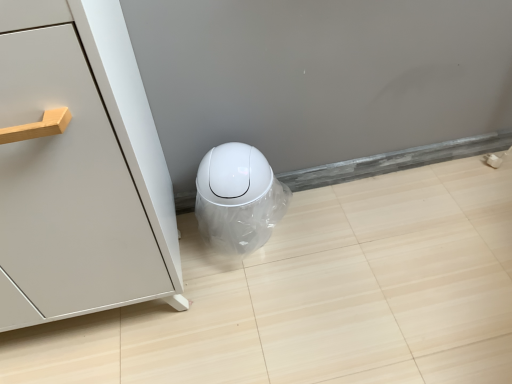
Question: From the image's perspective, is matte white cabinet at left above or below white glossy trash can at lower center?

Choices:
 (A) below
 (B) above

Answer: (B)

Question: Is point (108, 183) positioned closer to the camera than point (251, 165)?

Choices:
 (A) farther
 (B) closer

Answer: (B)

Question: In terms of width, does matte white cabinet at left look wider or thinner when compared to white glossy trash can at lower center?

Choices:
 (A) wide
 (B) thin

Answer: (A)

Question: Looking at their shapes, would you say white glossy trash can at lower center is wider or thinner than matte white cabinet at left?

Choices:
 (A) wide
 (B) thin

Answer: (B)

Question: Would you say white glossy trash can at lower center is to the left or to the right of matte white cabinet at left in the picture?

Choices:
 (A) left
 (B) right

Answer: (B)

Question: Considering the positions of white glossy trash can at lower center and matte white cabinet at left in the image, is white glossy trash can at lower center taller or shorter than matte white cabinet at left?

Choices:
 (A) tall
 (B) short

Answer: (B)

Question: Is white glossy trash can at lower center inside the boundaries of matte white cabinet at left, or outside?

Choices:
 (A) inside
 (B) outside

Answer: (B)